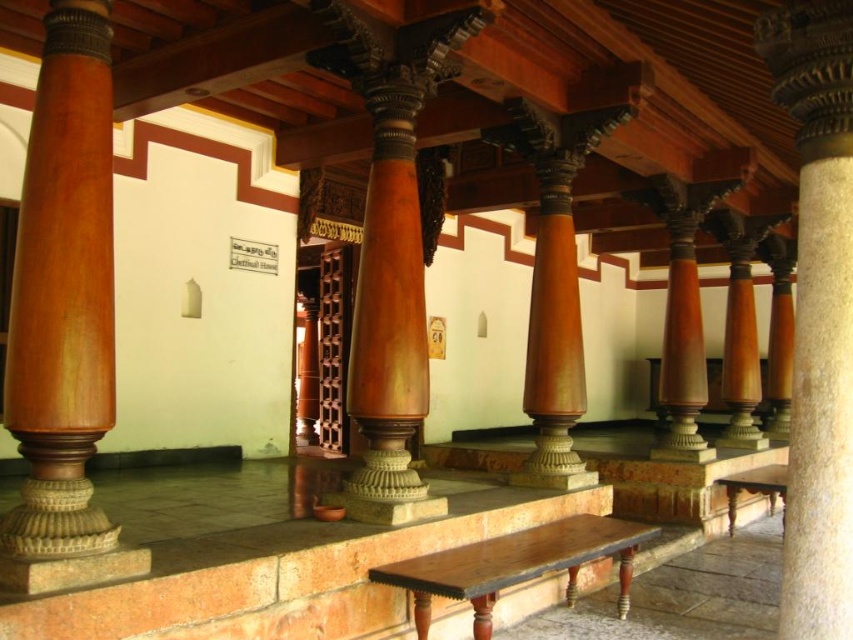
Question: Is brown polished stone column at center to the left of dark brown wood bench at center from the viewer's perspective?

Choices:
 (A) yes
 (B) no

Answer: (B)

Question: Is brown polished stone column at center to the left of dark brown wood bench at center from the viewer's perspective?

Choices:
 (A) no
 (B) yes

Answer: (A)

Question: Which point is farther to the camera?

Choices:
 (A) wooden polished bench at lower right
 (B) mahogany wood column at left
 (C) dark brown wood bench at center

Answer: (A)

Question: Which object appears closest to the camera in this image?

Choices:
 (A) wooden polished bench at lower right
 (B) mahogany wood column at left

Answer: (B)

Question: Can you confirm if brown polished stone column at center is smaller than dark brown wood bench at center?

Choices:
 (A) no
 (B) yes

Answer: (B)

Question: Estimate the real-world distances between objects in this image. Which object is farther from the mahogany wood column at left?

Choices:
 (A) dark brown wood bench at center
 (B) wooden polished bench at lower right
 (C) brown polished stone column at center

Answer: (B)